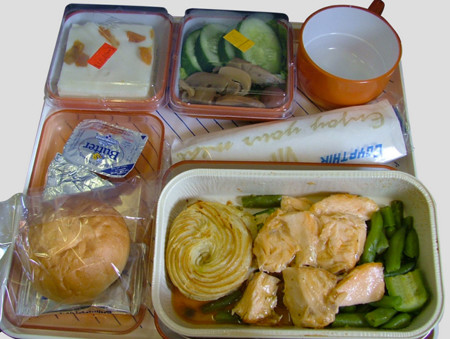
Find the location of a particular element. Image resolution: width=450 pixels, height=339 pixels. inside of the cup is located at coordinates (349, 42).